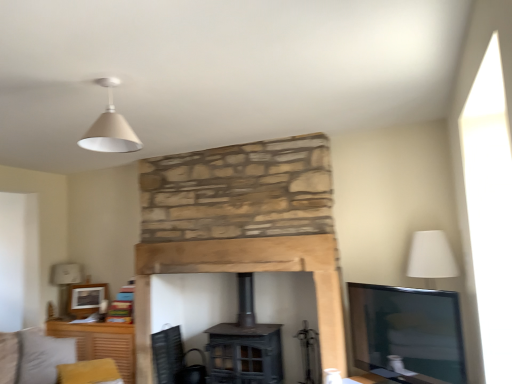
Question: From a real-world perspective, is matte white cone at upper center over matte wooden picture frame at upper left?

Choices:
 (A) yes
 (B) no

Answer: (A)

Question: Is matte white cone at upper center positioned far away from matte wooden picture frame at upper left?

Choices:
 (A) yes
 (B) no

Answer: (A)

Question: Is matte white cone at upper center shorter than matte wooden picture frame at upper left?

Choices:
 (A) yes
 (B) no

Answer: (A)

Question: Considering the relative positions of matte white cone at upper center and matte wooden picture frame at upper left in the image provided, is matte white cone at upper center to the left of matte wooden picture frame at upper left from the viewer's perspective?

Choices:
 (A) yes
 (B) no

Answer: (B)

Question: Is matte wooden picture frame at upper left at the back of matte white cone at upper center?

Choices:
 (A) yes
 (B) no

Answer: (B)

Question: From a real-world perspective, is white fabric lampshade at left physically located above or below light gray fabric couch at lower left?

Choices:
 (A) above
 (B) below

Answer: (A)

Question: Considering their positions, is white fabric lampshade at left located in front of or behind light gray fabric couch at lower left?

Choices:
 (A) front
 (B) behind

Answer: (B)

Question: From the image's perspective, relative to light gray fabric couch at lower left, is white fabric lampshade at left above or below?

Choices:
 (A) below
 (B) above

Answer: (B)

Question: Considering the positions of white fabric lampshade at left and light gray fabric couch at lower left in the image, is white fabric lampshade at left wider or thinner than light gray fabric couch at lower left?

Choices:
 (A) thin
 (B) wide

Answer: (A)

Question: Is rustic wood fireplace at center bigger or smaller than black mesh swivel chair at lower left?

Choices:
 (A) small
 (B) big

Answer: (B)

Question: From a real-world perspective, is rustic wood fireplace at center physically located above or below black mesh swivel chair at lower left?

Choices:
 (A) below
 (B) above

Answer: (B)

Question: Looking at their shapes, would you say rustic wood fireplace at center is wider or thinner than black mesh swivel chair at lower left?

Choices:
 (A) thin
 (B) wide

Answer: (A)

Question: Does point (322, 281) appear closer or farther from the camera than point (203, 369)?

Choices:
 (A) farther
 (B) closer

Answer: (B)

Question: Is matte wooden picture frame at upper left bigger or smaller than white fabric lampshade at left?

Choices:
 (A) big
 (B) small

Answer: (B)

Question: Do you think matte wooden picture frame at upper left is within white fabric lampshade at left, or outside of it?

Choices:
 (A) outside
 (B) inside

Answer: (A)